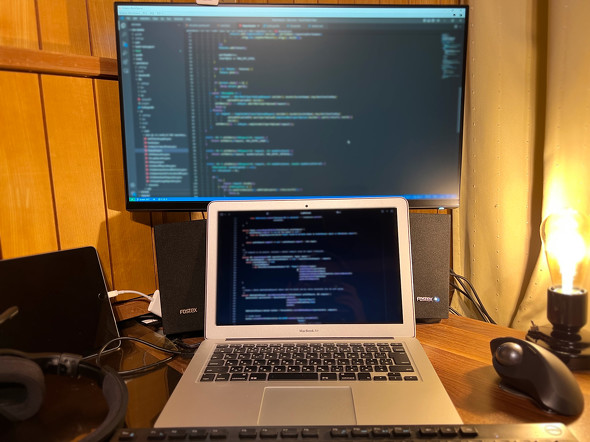
Where is `wood surface`? The width and height of the screenshot is (590, 442). wood surface is located at coordinates (449, 356), (140, 394).